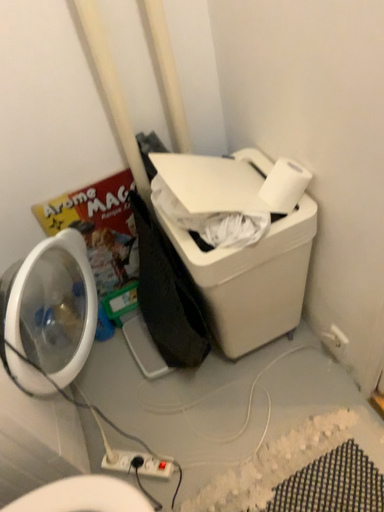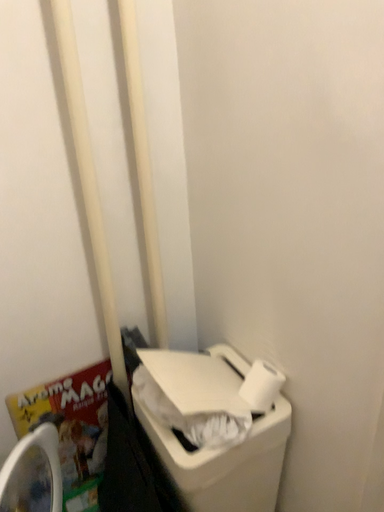
Question: How did the camera likely rotate when shooting the video?

Choices:
 (A) rotated right
 (B) rotated left

Answer: (A)